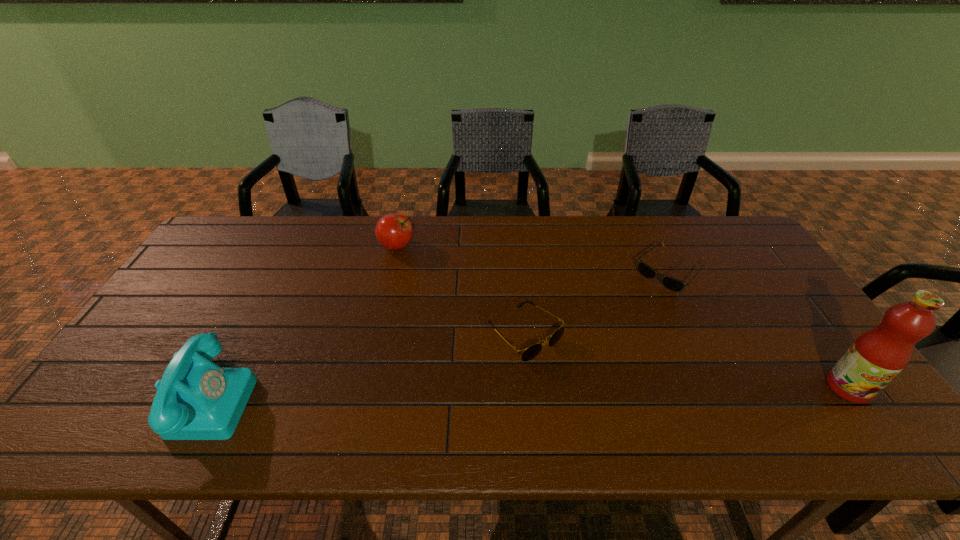
At what (x,y) coordinates should I click in order to perform the action: click on free space located on the dial of the telephone. Please return your answer as a coordinate pair (x, y). Looking at the image, I should click on (369, 397).

At what (x,y) coordinates should I click in order to perform the action: click on free space located on the front-facing side of the third object from left to right. Please return your answer as a coordinate pair (x, y). The height and width of the screenshot is (540, 960). Looking at the image, I should click on coord(580,386).

Where is `vacant region located on the front-facing side of the third object from left to right`? vacant region located on the front-facing side of the third object from left to right is located at coordinates (564, 372).

Identify the location of free space located 0.180m on the stem of the apple. (439, 284).

What are the coordinates of `free region located 0.220m on the stem of the apple` in the screenshot? It's located at tap(447, 291).

The image size is (960, 540). I want to click on vacant space located 0.290m on the stem of the apple, so click(x=462, y=303).

Find the location of a particular element. The image size is (960, 540). free space located on the lenses of the second object from right to left is located at coordinates (626, 314).

Identify the location of vacant space located 0.250m on the lenses of the second object from right to left. (606, 334).

This screenshot has height=540, width=960. In order to click on free space located 0.100m on the lenses of the second object from right to left in this screenshot , I will do `click(635, 305)`.

Where is `apple that is at the far edge`? This screenshot has height=540, width=960. apple that is at the far edge is located at coordinates (393, 231).